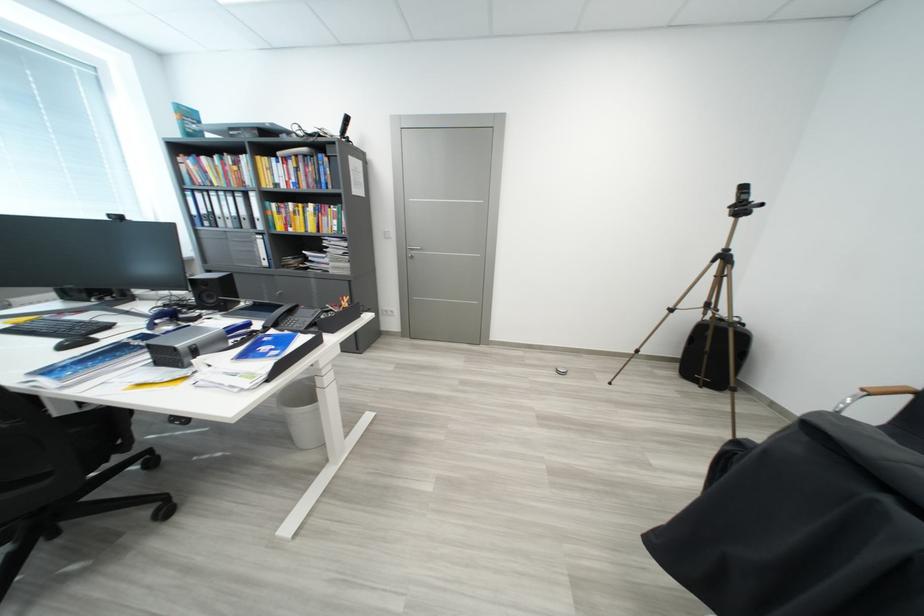
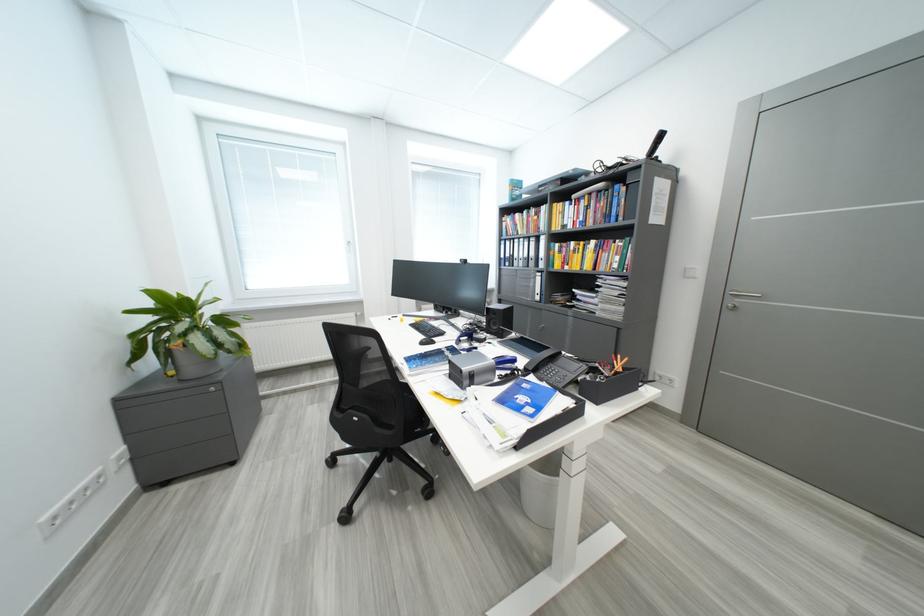
In the second image, find the point that corresponds to the point at 270,245 in the first image.

(546, 282)